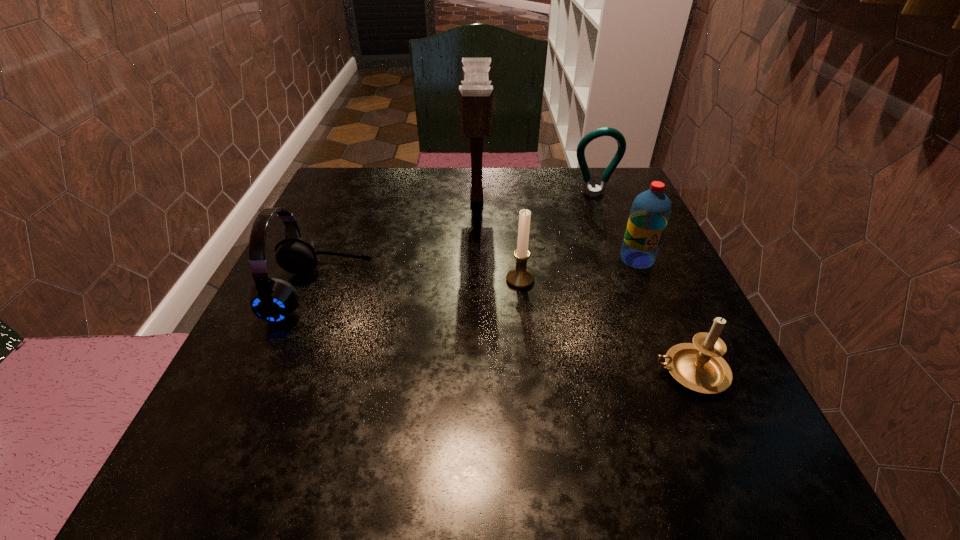
Where is `mallet`? This screenshot has height=540, width=960. mallet is located at coordinates (475, 92).

This screenshot has width=960, height=540. What are the coordinates of `the tallest object` in the screenshot? It's located at (475, 92).

At what (x,y) coordinates should I click in order to perform the action: click on bottle opener. Please return your answer as a coordinate pair (x, y). Image resolution: width=960 pixels, height=540 pixels. Looking at the image, I should click on (605, 131).

I want to click on the leftmost object, so click(x=273, y=300).

Locate an element on the screen. The height and width of the screenshot is (540, 960). water bottle is located at coordinates (650, 211).

Where is `the farther candle holder`? Image resolution: width=960 pixels, height=540 pixels. the farther candle holder is located at coordinates (520, 277).

The image size is (960, 540). In order to click on the taller candle holder in this screenshot , I will do (x=520, y=277).

The image size is (960, 540). In order to click on the shortest object in this screenshot , I will do `click(698, 366)`.

Locate an element on the screen. the right candle holder is located at coordinates (698, 366).

Locate an element on the screen. The width and height of the screenshot is (960, 540). vacant space positioned on the left of the tallest object is located at coordinates (414, 199).